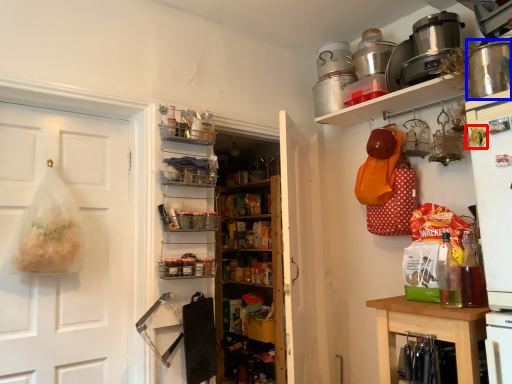
Question: Among these objects, which one is farthest to the camera, food (highlighted by a red box) or appliance (highlighted by a blue box)?

Choices:
 (A) food
 (B) appliance

Answer: (A)